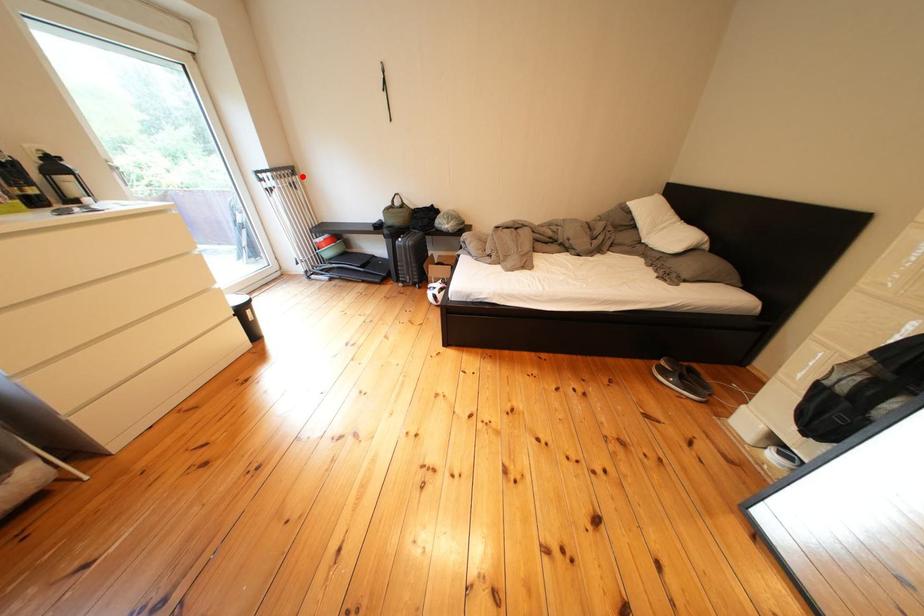
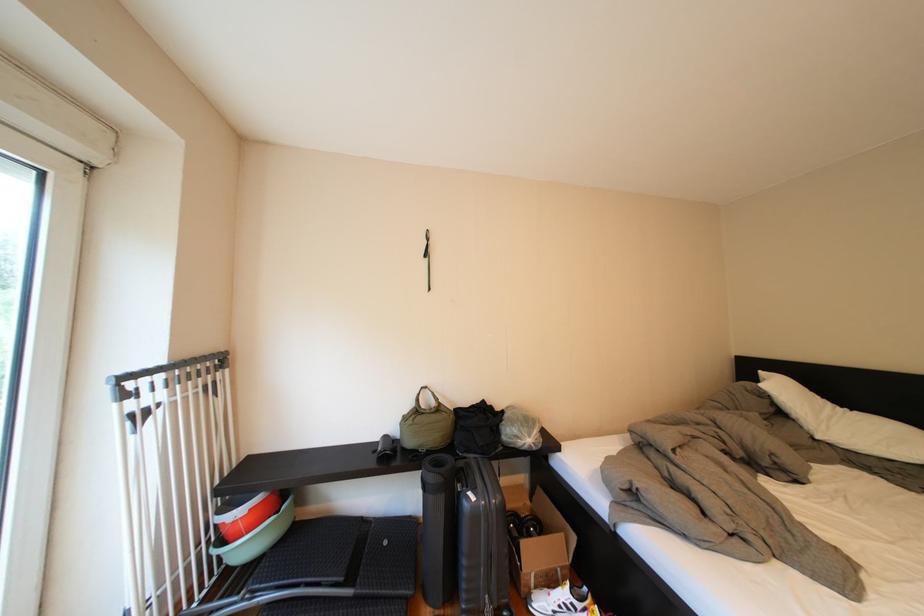
The point at the highlighted location is marked in the first image. Where is the corresponding point in the second image?

(224, 369)